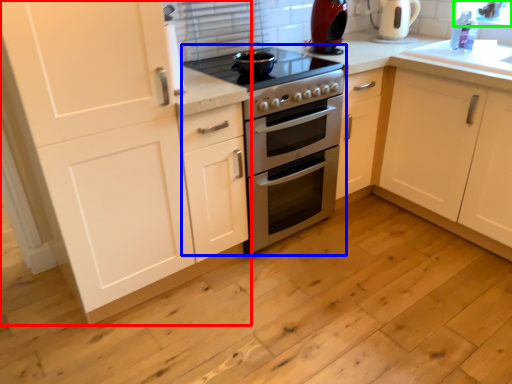
Question: Based on their relative distances, which object is farther from cabinetry (highlighted by a red box)? Choose from appliance (highlighted by a blue box) and window screen (highlighted by a green box).

Choices:
 (A) appliance
 (B) window screen

Answer: (B)